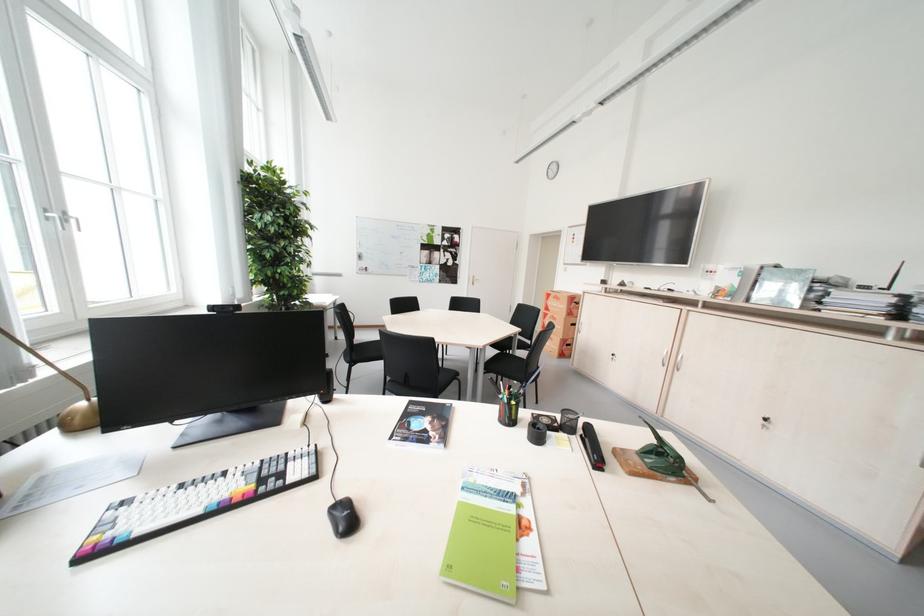
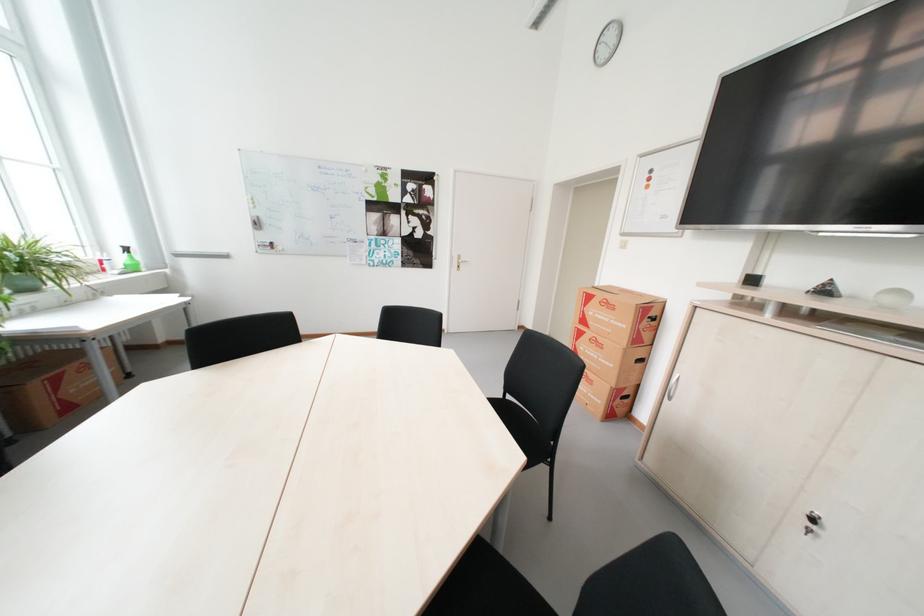
In the second image, find the point that corresponds to point 631,285 in the first image.

(835, 292)